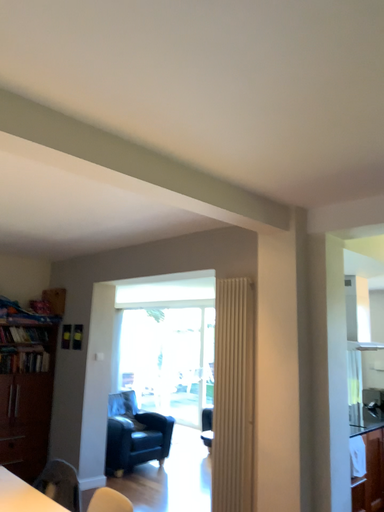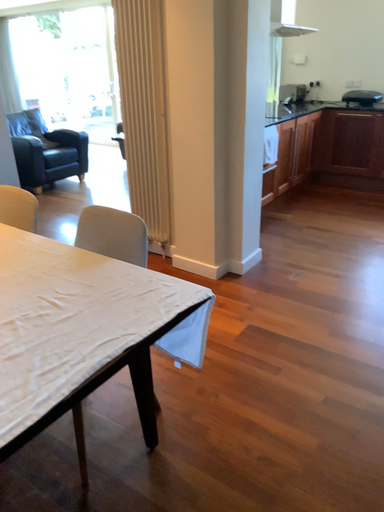
Question: How did the camera likely rotate when shooting the video?

Choices:
 (A) rotated left
 (B) rotated right

Answer: (B)